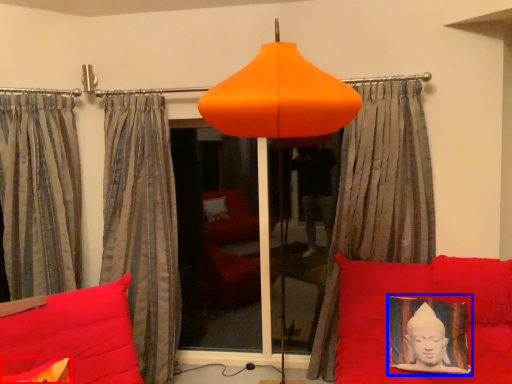
Question: Among these objects, which one is farthest to the camera, pillow (highlighted by a red box) or picture frame (highlighted by a blue box)?

Choices:
 (A) pillow
 (B) picture frame

Answer: (B)